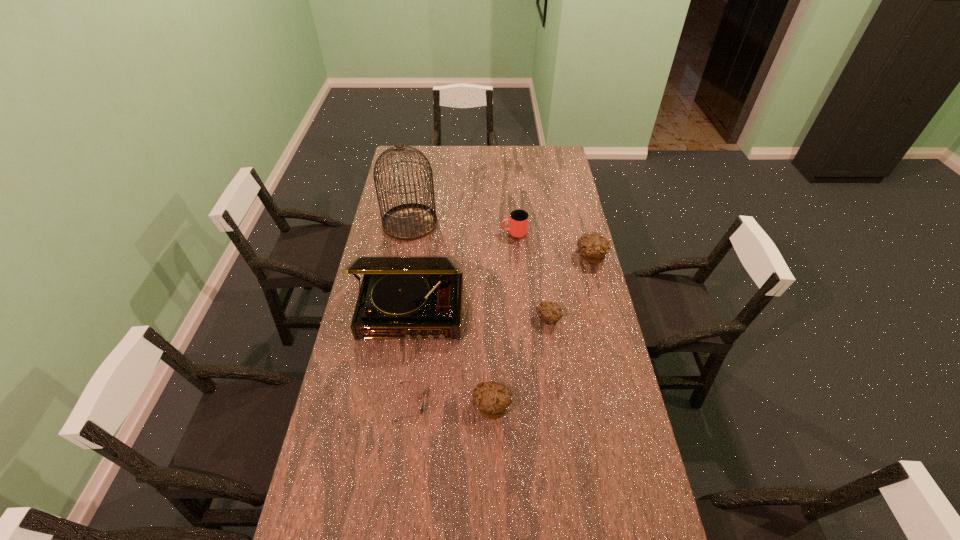
The image size is (960, 540). What are the coordinates of `the leftmost muffin` in the screenshot? It's located at (492, 399).

The width and height of the screenshot is (960, 540). I want to click on the fifth tallest object, so click(x=492, y=399).

Locate an element on the screen. The height and width of the screenshot is (540, 960). the second farthest muffin is located at coordinates (549, 313).

You are a GUI agent. You are given a task and a screenshot of the screen. Output one action in this format:
    pyautogui.click(x=<x>, y=<y>)
    Task: Click on the second shortest object
    
    Given the screenshot: What is the action you would take?
    pyautogui.click(x=549, y=313)

Identify the location of the farthest muffin. The height and width of the screenshot is (540, 960). (593, 247).

You are a GUI agent. You are given a task and a screenshot of the screen. Output one action in this format:
    pyautogui.click(x=<x>, y=<y>)
    Task: Click on the fifth nearest object
    This screenshot has width=960, height=540.
    Given the screenshot: What is the action you would take?
    pyautogui.click(x=593, y=247)

The width and height of the screenshot is (960, 540). I want to click on birdcage, so click(x=410, y=221).

Where is `cup`? The height and width of the screenshot is (540, 960). cup is located at coordinates (518, 225).

Where is `record player`? The height and width of the screenshot is (540, 960). record player is located at coordinates (401, 296).

Where is `the shortest object`? the shortest object is located at coordinates (422, 407).